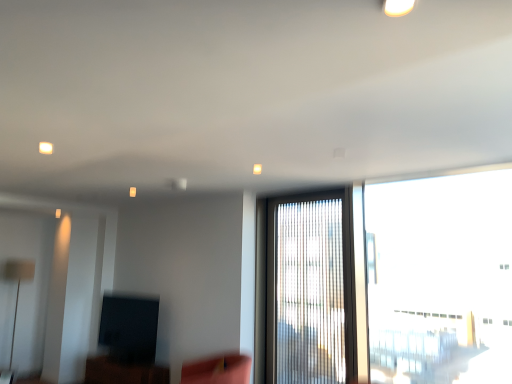
This screenshot has height=384, width=512. Describe the element at coordinates (306, 289) in the screenshot. I see `translucent glass window at center, which is counted as the second window, starting from the right` at that location.

Locate an element on the screen. This screenshot has width=512, height=384. matte black tv at lower left is located at coordinates (129, 328).

Consider the image. Can you tell me how much white glossy light fixture at upper center and matte black tv at lower left differ in facing direction?

They differ by 91.9 degrees in their facing directions.

Considering the positions of point (392, 7) and point (110, 369), is point (392, 7) closer or farther from the camera than point (110, 369)?

Point (392, 7).

Does white glossy light fixture at upper center appear on the right side of matte black tv at lower left?

Yes.

Does white glossy light fixture at upper center touch matte black tv at lower left?

white glossy light fixture at upper center is not next to matte black tv at lower left, and they're not touching.

From the image's perspective, is velvet pink swivel chair at lower center located beneath matte black tv at lower left?

No, from the image's perspective, velvet pink swivel chair at lower center is not beneath matte black tv at lower left.

Considering the positions of objects velvet pink swivel chair at lower center and matte black tv at lower left in the image provided, who is more to the left, velvet pink swivel chair at lower center or matte black tv at lower left?

From the viewer's perspective, matte black tv at lower left appears more on the left side.

From a real-world perspective, who is located lower, velvet pink swivel chair at lower center or matte black tv at lower left?

matte black tv at lower left, from a real-world perspective.

Would you say matte black tv at lower left is part of velvet pink swivel chair at lower center's contents?

No, matte black tv at lower left is located outside of velvet pink swivel chair at lower center.

From the picture: Is the surface of white glossy light fixture at upper center in direct contact with velvet pink swivel chair at lower center?

No.

From a real-world perspective, relative to velvet pink swivel chair at lower center, is white glossy light fixture at upper center vertically above or below?

white glossy light fixture at upper center is above velvet pink swivel chair at lower center.

Is white glossy light fixture at upper center closer to the viewer compared to velvet pink swivel chair at lower center?

Yes, it is in front of velvet pink swivel chair at lower center.

Image resolution: width=512 pixels, height=384 pixels. Identify the location of swivel chair beneath the white glossy light fixture at upper center (from a real-world perspective). (217, 370).

Is transparent glass window at right, positioned as the second window in left-to-right order, shorter than velvet pink swivel chair at lower center?

No.

Considering the relative sizes of transparent glass window at right, the 1th window positioned from the right, and velvet pink swivel chair at lower center in the image provided, is transparent glass window at right, the 1th window positioned from the right, smaller than velvet pink swivel chair at lower center?

Actually, transparent glass window at right, the 1th window positioned from the right, might be larger than velvet pink swivel chair at lower center.

Are transparent glass window at right, positioned as the second window in left-to-right order, and velvet pink swivel chair at lower center making contact?

No, transparent glass window at right, positioned as the second window in left-to-right order, is not with velvet pink swivel chair at lower center.

Considering the positions of objects transparent glass window at right, the 1th window positioned from the right, and velvet pink swivel chair at lower center in the image provided, who is more to the right, transparent glass window at right, the 1th window positioned from the right, or velvet pink swivel chair at lower center?

transparent glass window at right, the 1th window positioned from the right.

Can you confirm if velvet pink swivel chair at lower center is taller than matte black tv at lower left?

In fact, velvet pink swivel chair at lower center may be shorter than matte black tv at lower left.

Find the location of a particular element. The width and height of the screenshot is (512, 384). window screen behind the velvet pink swivel chair at lower center is located at coordinates (129, 328).

Does point (208, 381) come behind point (122, 326)?

No, it is in front of (122, 326).

Which object is wider, velvet pink swivel chair at lower center or matte black tv at lower left?

velvet pink swivel chair at lower center is wider.

Is the surface of matte black tv at lower left in direct contact with translucent glass window at center, which appears as the 1th window when viewed from the left?

No, matte black tv at lower left is not with translucent glass window at center, which appears as the 1th window when viewed from the left.

What's the angular difference between matte black tv at lower left and translucent glass window at center, which is counted as the second window, starting from the right,'s facing directions?

0.0392 degrees.

Which is in front, point (99, 358) or point (319, 198)?

The point (319, 198) is more forward.

Between matte black tv at lower left and translucent glass window at center, which is counted as the second window, starting from the right, which one appears on the left side from the viewer's perspective?

matte black tv at lower left.

From a real-world perspective, is matte black tv at lower left located beneath matte black tv at lower left?

No.

How many degrees apart are the facing directions of matte black tv at lower left and matte black tv at lower left?

1.03 degrees separate the facing orientations of matte black tv at lower left and matte black tv at lower left.

Is matte black tv at lower left to the left of matte black tv at lower left from the viewer's perspective?

No, matte black tv at lower left is not to the left of matte black tv at lower left.

Is matte black tv at lower left facing away from matte black tv at lower left?

No.

Image resolution: width=512 pixels, height=384 pixels. I want to click on lighting in front of the matte black tv at lower left, so click(397, 7).

Locate an element on the screen. furniture behind the velvet pink swivel chair at lower center is located at coordinates (x=123, y=372).

Considering their positions, is translucent glass window at center, which appears as the 1th window when viewed from the left, positioned further to velvet pink swivel chair at lower center than matte black tv at lower left?

The object further to velvet pink swivel chair at lower center is matte black tv at lower left.

From the image, which object appears to be farther from velvet pink swivel chair at lower center, white glossy light fixture at upper center or translucent glass window at center, which appears as the 1th window when viewed from the left?

Among the two, white glossy light fixture at upper center is located further to velvet pink swivel chair at lower center.

Which object lies nearer to the anchor point matte black tv at lower left, velvet pink swivel chair at lower center or white glossy light fixture at upper center?

Based on the image, velvet pink swivel chair at lower center appears to be nearer to matte black tv at lower left.

Estimate the real-world distances between objects in this image. Which object is further from white glossy light fixture at upper center, transparent glass window at right, the 1th window positioned from the right, or matte black tv at lower left?

Among the two, matte black tv at lower left is located further to white glossy light fixture at upper center.

Estimate the real-world distances between objects in this image. Which object is further from matte black tv at lower left, matte black tv at lower left or translucent glass window at center, which appears as the 1th window when viewed from the left?

The object further to matte black tv at lower left is translucent glass window at center, which appears as the 1th window when viewed from the left.

When comparing their distances from matte black tv at lower left, does matte black tv at lower left or white glossy light fixture at upper center seem further?

Among the two, white glossy light fixture at upper center is located further to matte black tv at lower left.

Estimate the real-world distances between objects in this image. Which object is closer to velvet pink swivel chair at lower center, transparent glass window at right, the 1th window positioned from the right, or matte black tv at lower left?

matte black tv at lower left is closer to velvet pink swivel chair at lower center.

Which object lies nearer to the anchor point translucent glass window at center, which is counted as the second window, starting from the right, matte black tv at lower left or transparent glass window at right, positioned as the second window in left-to-right order?

transparent glass window at right, positioned as the second window in left-to-right order.

Where is `window screen situated between matte black tv at lower left and transparent glass window at right, positioned as the second window in left-to-right order, from left to right`? The height and width of the screenshot is (384, 512). window screen situated between matte black tv at lower left and transparent glass window at right, positioned as the second window in left-to-right order, from left to right is located at coordinates (129, 328).

The height and width of the screenshot is (384, 512). In order to click on swivel chair between white glossy light fixture at upper center and translucent glass window at center, which appears as the 1th window when viewed from the left, from front to back in this screenshot , I will do (x=217, y=370).

Find the location of a particular element. The height and width of the screenshot is (384, 512). window screen located between matte black tv at lower left and translucent glass window at center, which is counted as the second window, starting from the right, in the left-right direction is located at coordinates (129, 328).

Where is `window situated between velvet pink swivel chair at lower center and transparent glass window at right, positioned as the second window in left-to-right order, from left to right`? window situated between velvet pink swivel chair at lower center and transparent glass window at right, positioned as the second window in left-to-right order, from left to right is located at coordinates [306, 289].